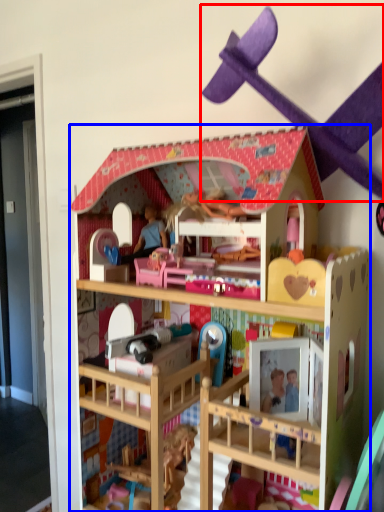
Question: Among these objects, which one is farthest to the camera, toy (highlighted by a red box) or toy (highlighted by a blue box)?

Choices:
 (A) toy
 (B) toy

Answer: (B)